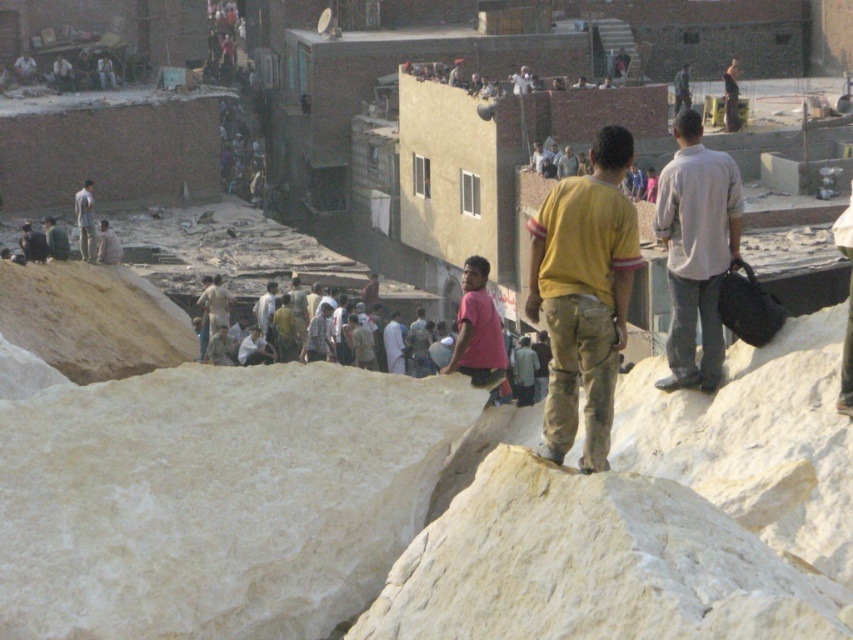
Question: Among these objects, which one is nearest to the camera?

Choices:
 (A) pink fabric shirt at center
 (B) light gray cotton shirt at right
 (C) light brown leather jacket at upper left
 (D) yellow cotton shirt at center

Answer: (D)

Question: Which object appears closest to the camera in this image?

Choices:
 (A) pink fabric shirt at center
 (B) yellow cotton shirt at center

Answer: (B)

Question: Is yellow cotton shirt at center positioned before light brown leather jacket at upper left?

Choices:
 (A) no
 (B) yes

Answer: (B)

Question: Is yellow cotton shirt at center in front of pink fabric shirt at center?

Choices:
 (A) no
 (B) yes

Answer: (B)

Question: Considering the real-world distances, which object is closest to the light brown leather jacket at upper left?

Choices:
 (A) light gray cotton shirt at right
 (B) pink fabric shirt at center

Answer: (B)

Question: In this image, where is pink fabric shirt at center located relative to light brown leather jacket at upper left?

Choices:
 (A) below
 (B) above

Answer: (A)